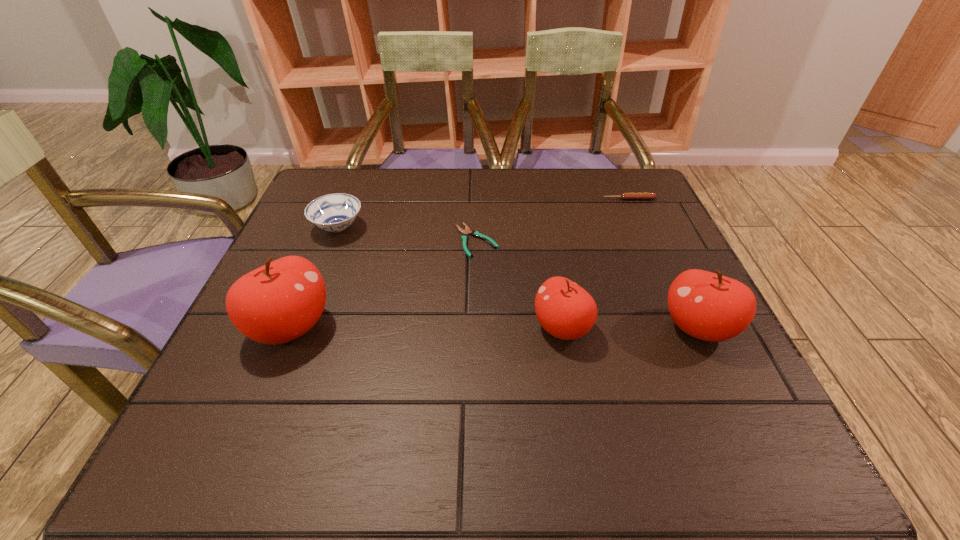
Locate an element on the screen. apple present at the right edge is located at coordinates (708, 306).

Identify the location of sausage at the right edge. The image size is (960, 540). (625, 196).

Locate an element on the screen. This screenshot has width=960, height=540. object located in the far left corner section of the desktop is located at coordinates (335, 212).

You are a GUI agent. You are given a task and a screenshot of the screen. Output one action in this format:
    pyautogui.click(x=<x>, y=<y>)
    Task: Click on the object positioned at the far right corner
    The image size is (960, 540).
    Given the screenshot: What is the action you would take?
    pyautogui.click(x=625, y=196)

Identify the location of vacant space at the far edge of the desktop. (575, 182).

This screenshot has height=540, width=960. Find the location of `free point at the near edge`. free point at the near edge is located at coordinates (305, 388).

The width and height of the screenshot is (960, 540). In the image, there is a desktop. Find the location of `free space at the left edge`. free space at the left edge is located at coordinates (286, 243).

At what (x,y) coordinates should I click in order to perform the action: click on free space at the right edge. Please return your answer as a coordinate pair (x, y). Looking at the image, I should click on (664, 248).

In the image, there is a desktop. At what (x,y) coordinates should I click in order to perform the action: click on vacant space at the far left corner. Please return your answer as a coordinate pair (x, y). Image resolution: width=960 pixels, height=540 pixels. Looking at the image, I should click on (365, 184).

Identify the location of blank area at the near left corner. The height and width of the screenshot is (540, 960). (231, 397).